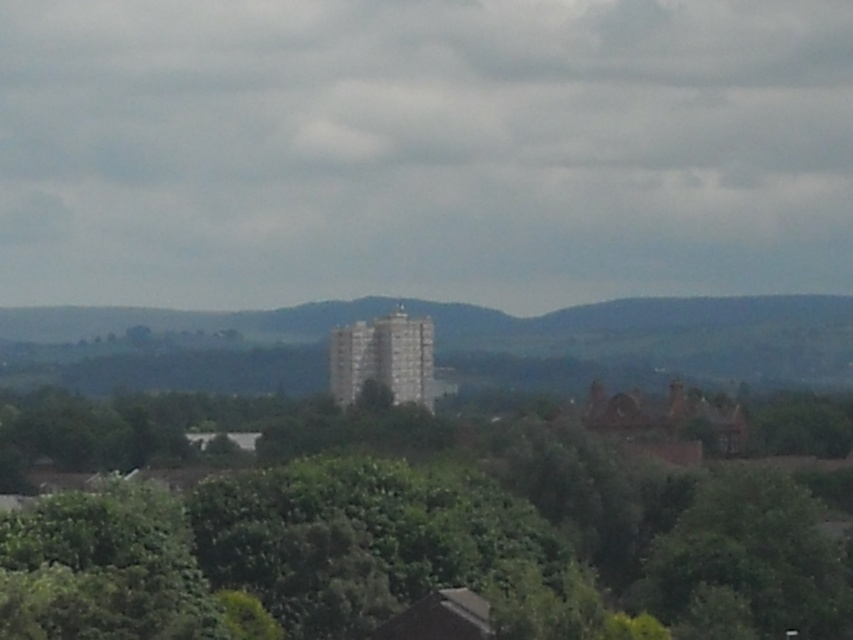
Question: Which point is closer to the camera?

Choices:
 (A) (79, 417)
 (B) (456, 360)

Answer: (A)

Question: Does green leafy tree at center appear on the right side of green textured hill at center?

Choices:
 (A) no
 (B) yes

Answer: (B)

Question: Which of the following is the closest to the observer?

Choices:
 (A) green leafy tree at center
 (B) green textured hill at center

Answer: (A)

Question: Can you confirm if green leafy tree at center is wider than green textured hill at center?

Choices:
 (A) no
 (B) yes

Answer: (A)

Question: Is green leafy tree at center to the right of green textured hill at center from the viewer's perspective?

Choices:
 (A) yes
 (B) no

Answer: (A)